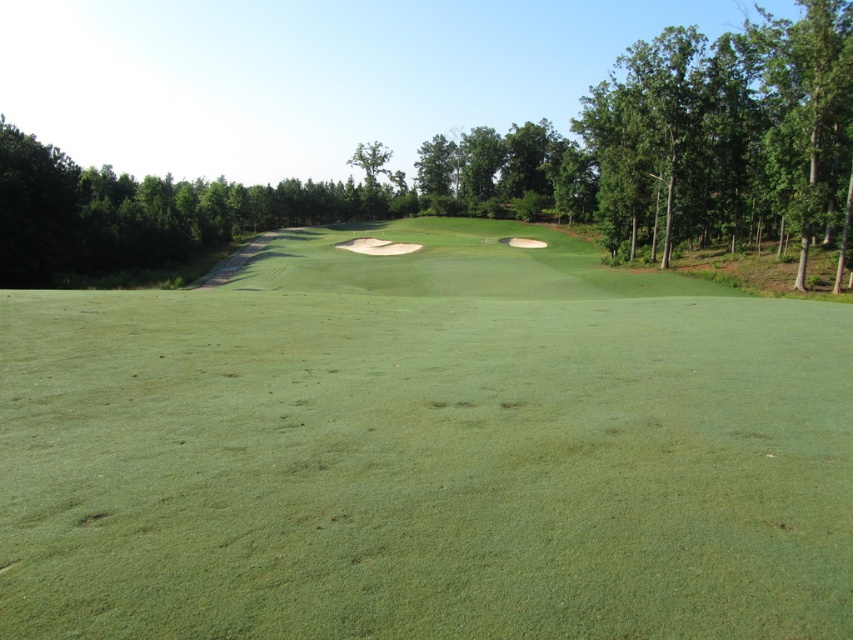
Can you confirm if green grassy golf course at center is thinner than green leafy tree at center?

Yes, green grassy golf course at center is thinner than green leafy tree at center.

Can you confirm if green grassy golf course at center is positioned to the left of green leafy tree at center?

Incorrect, green grassy golf course at center is not on the left side of green leafy tree at center.

Where is `green grassy golf course at center`? green grassy golf course at center is located at coordinates (425, 449).